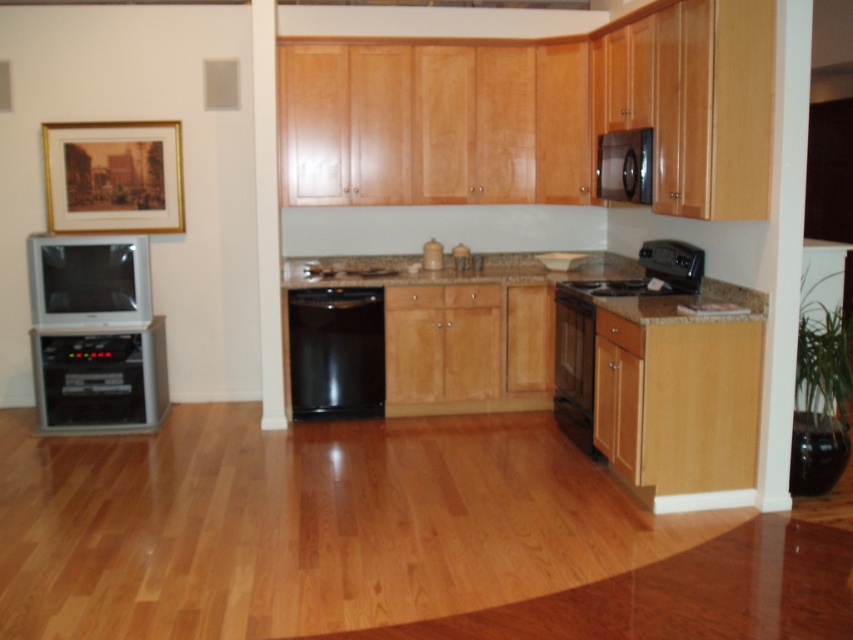
You are planning to move a wide painting that is 1.2 meters wide. You want to place it either above the matte silver television at left or above the black glossy stove at center. Based on their widths, which location would allow the painting to fit better?

The matte silver television at left is wider than the black glossy stove at center. Therefore, placing the painting above the matte silver television at left would provide a better fit since its width can accommodate the 1.2 meters wide painting more appropriately.